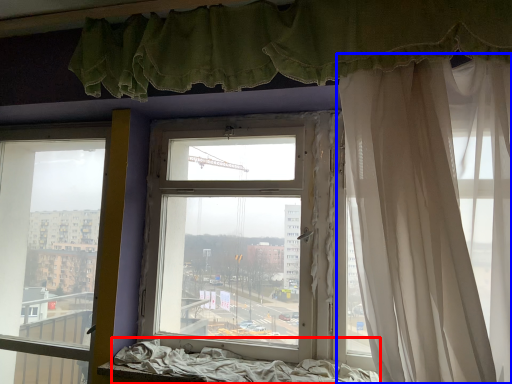
Question: Among these objects, which one is farthest to the camera, bed frame (highlighted by a red box) or curtain (highlighted by a blue box)?

Choices:
 (A) bed frame
 (B) curtain

Answer: (A)